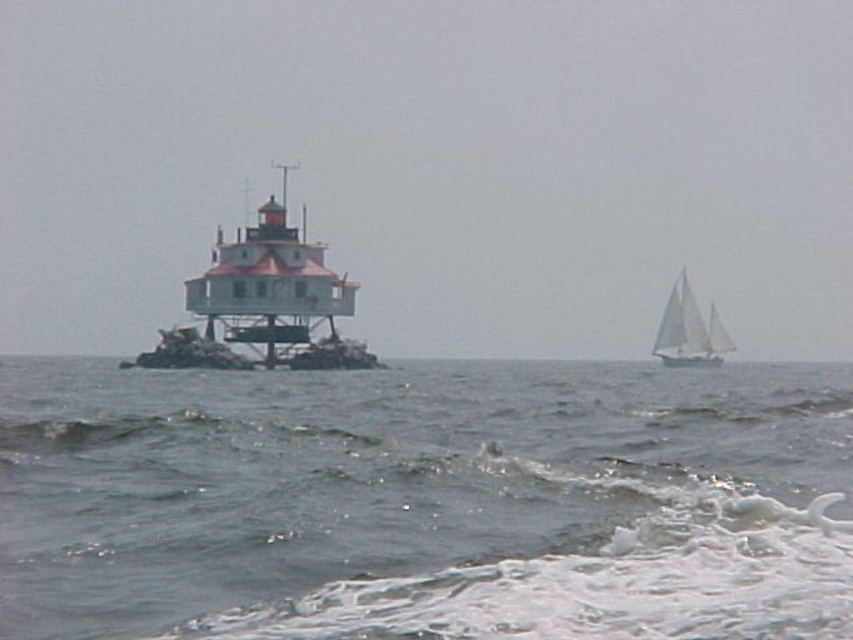
You are a photographer trying to capture the lighthouse and the sailboat in the image. You notice two points marked in the scene. Which point, point (410,376) or point (251,241), is closer to your camera lens?

Point (410,376) is closer to the camera than point (251,241).

From the picture: You are a sailor on the white sailboat at right and need to reach the white painted wood lighthouse at center. Given that your boat can only approach within 40 meters of any structure due to safety regulations, can you safely navigate closer to the lighthouse?

The distance between the white painted wood lighthouse at center and the white sailboat at right is 38.12 meters. Since this is under the 40 meters safety limit, you can safely navigate closer to the lighthouse.

You are a sailor trying to navigate your boat to the lighthouse. You see the gray water at center marked by point (424, 500). Is this point closer to the lighthouse or the sailboat?

The gray water at center is represented by point (424, 500). Since the lighthouse is situated on a rocky outcrop in the middle of the ocean and the sailboat is in the background, the point is closer to the lighthouse than the sailboat.